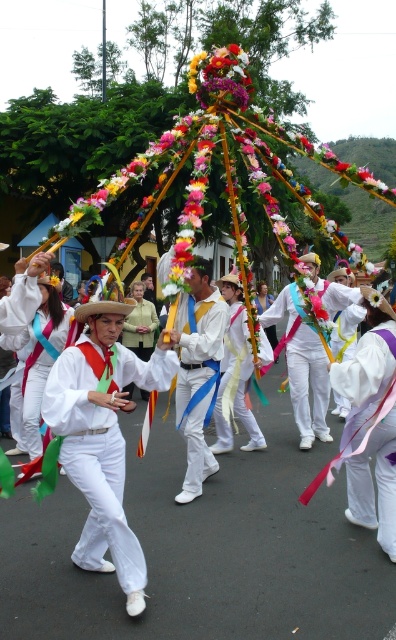
Who is taller, white satin outfit at center or white satin shirt at center?

Standing taller between the two is white satin shirt at center.

Does white satin outfit at center lie behind white satin shirt at center?

No, white satin outfit at center is closer to the viewer.

Describe the element at coordinates (203, 548) in the screenshot. I see `white satin outfit at center` at that location.

Locate an element on the screen. This screenshot has width=396, height=640. white satin outfit at center is located at coordinates (203, 548).